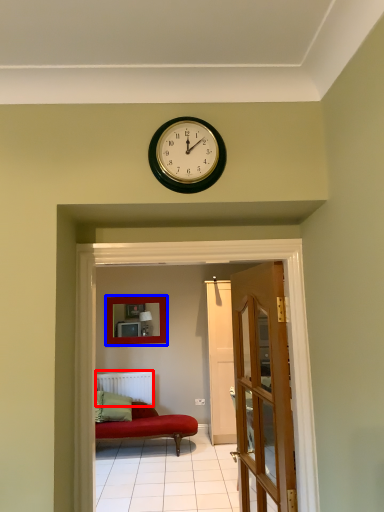
Question: Which of the following is the closest to the observer, radiator (highlighted by a red box) or picture frame (highlighted by a blue box)?

Choices:
 (A) radiator
 (B) picture frame

Answer: (A)